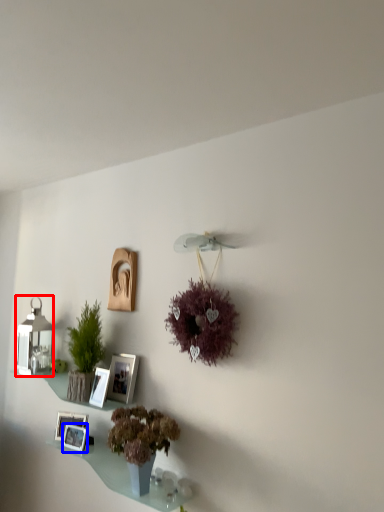
Question: Among these objects, which one is nearest to the camera, lamp (highlighted by a red box) or picture frame (highlighted by a blue box)?

Choices:
 (A) lamp
 (B) picture frame

Answer: (B)